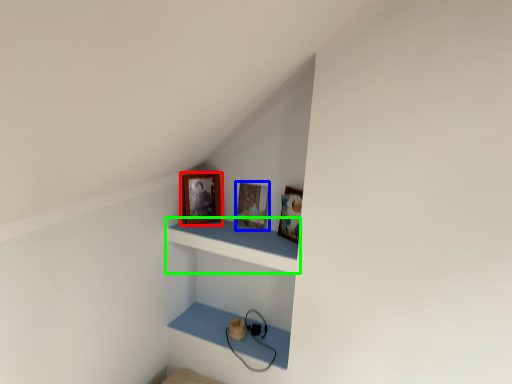
Question: Estimate the real-world distances between objects in this image. Which object is farther from picture frame (highlighted by a red box), picture frame (highlighted by a blue box) or shelf (highlighted by a green box)?

Choices:
 (A) picture frame
 (B) shelf

Answer: (B)